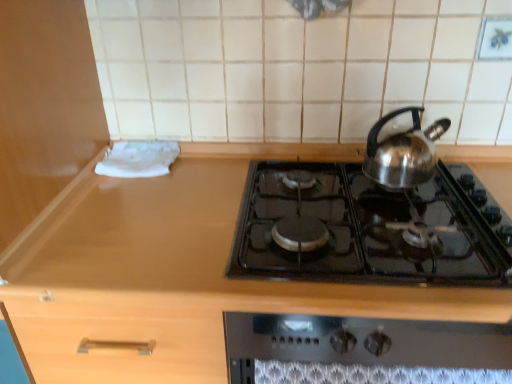
The width and height of the screenshot is (512, 384). In order to click on vacant space situated on the left part of shiny metallic kettle at upper right in this screenshot , I will do `click(325, 193)`.